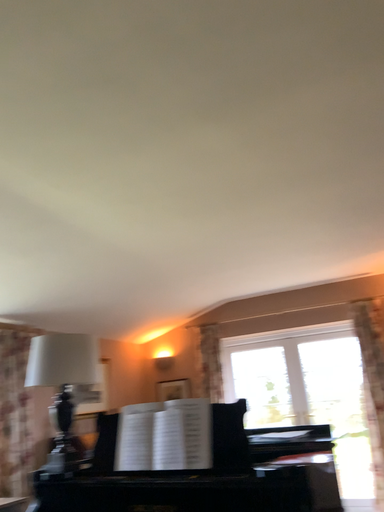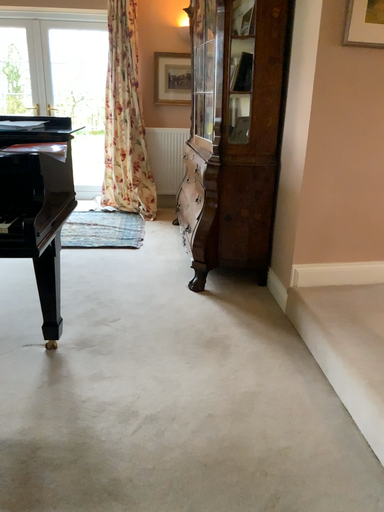
Question: Which way did the camera rotate in the video?

Choices:
 (A) rotated right
 (B) rotated left

Answer: (A)